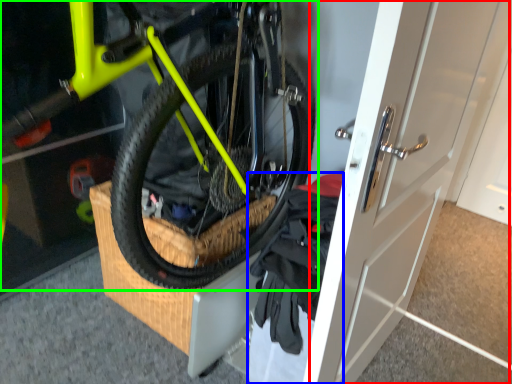
Question: Estimate the real-world distances between objects in this image. Which object is closer to door (highlighted by a red box), clothing (highlighted by a blue box) or bicycle (highlighted by a green box)?

Choices:
 (A) clothing
 (B) bicycle

Answer: (A)